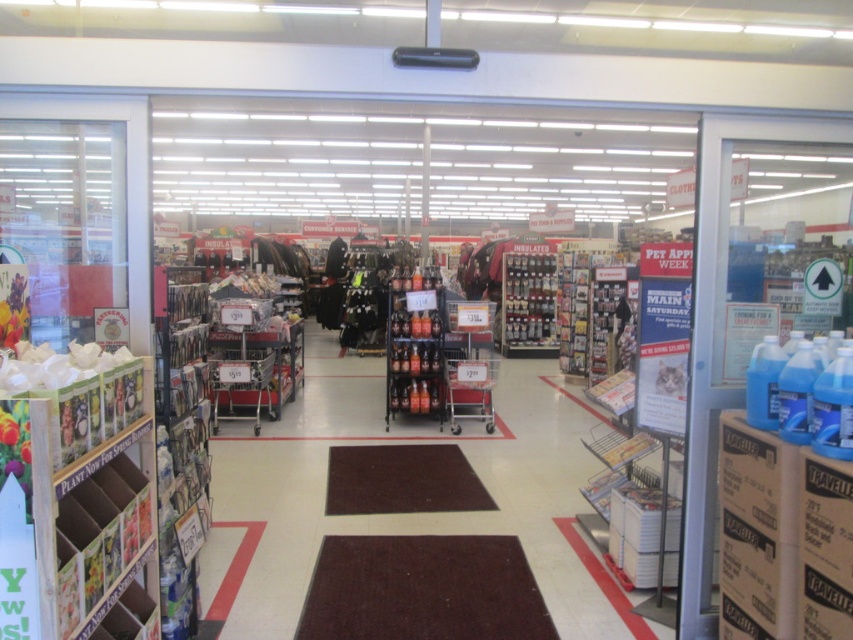
Question: Is metallic silver shopping cart at center to the right of metallic silver bottles at center from the viewer's perspective?

Choices:
 (A) no
 (B) yes

Answer: (A)

Question: Does metallic silver shopping cart at center appear over metallic silver bottles at center?

Choices:
 (A) yes
 (B) no

Answer: (B)

Question: Can you confirm if metallic silver chocolates at center is wider than silver metallic shopping cart at center?

Choices:
 (A) yes
 (B) no

Answer: (A)

Question: Which object is farther from the camera taking this photo?

Choices:
 (A) silver metallic shopping cart at center
 (B) metallic silver shopping cart at center
 (C) metallic silver bottles at center

Answer: (C)

Question: Which point appears farthest from the camera in this image?

Choices:
 (A) (469, 353)
 (B) (544, 355)

Answer: (B)

Question: Which object appears farthest from the camera in this image?

Choices:
 (A) silver metallic shopping cart at center
 (B) metallic silver shopping cart at center
 (C) metallic silver bottles at center
 (D) metallic silver chocolates at center

Answer: (D)